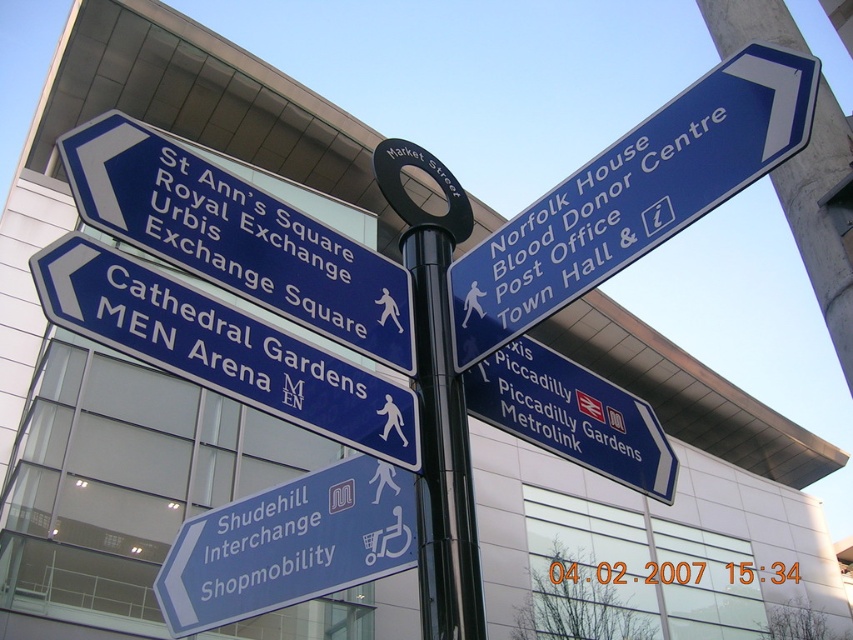
You are standing in front of the cluster of blue directional signs mounted on a black pole. You notice two points marked on the signs at coordinates point (x=151, y=220) and point (x=540, y=417). Which point is nearer to your current position?

Point (x=151, y=220) is closer to the camera than point (x=540, y=417), so the point (x=151, y=220) is nearer to your current position.

You are standing at point [236,237]. What object is located at your current position?

The blue plastic sign at upper left is located at point [236,237].